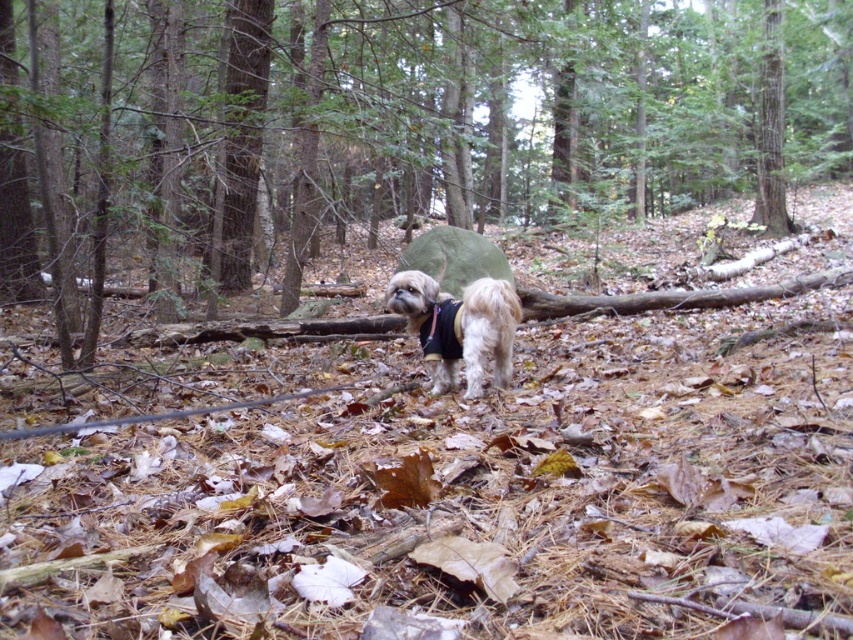
Who is positioned more to the left, green matte tent at center or fuzzy white dog at center?

fuzzy white dog at center

Is green matte tent at center to the left of fuzzy white dog at center from the viewer's perspective?

In fact, green matte tent at center is to the right of fuzzy white dog at center.

Does point (158, 26) come behind point (407, 305)?

Yes, point (158, 26) is behind point (407, 305).

This screenshot has height=640, width=853. Identify the location of green matte tent at center. [440, 116].